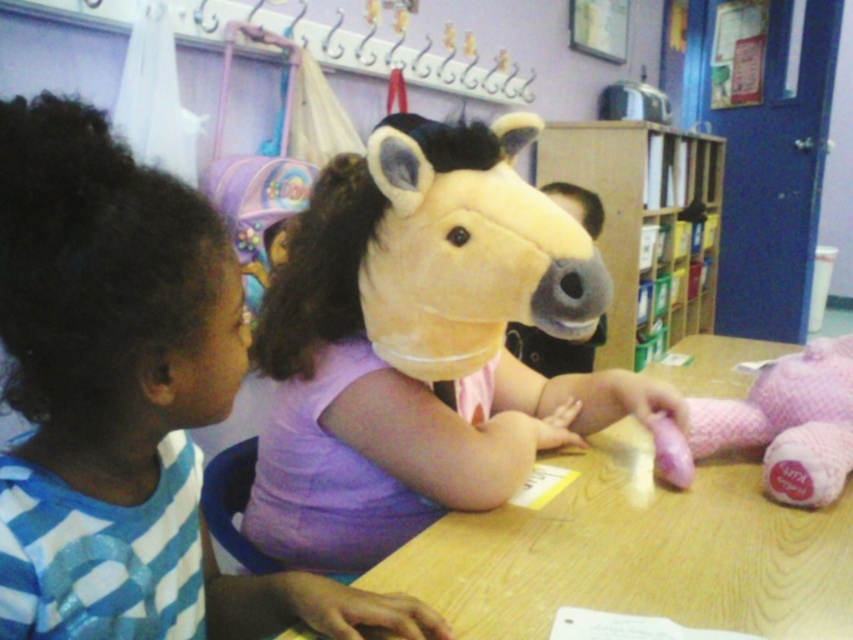
Question: Does wooden table at center appear on the right side of pink plush bear at right?

Choices:
 (A) no
 (B) yes

Answer: (A)

Question: Does soft plush horse head at center have a greater width compared to purple cotton shirt at upper center?

Choices:
 (A) no
 (B) yes

Answer: (B)

Question: Which object is closer to the camera taking this photo?

Choices:
 (A) soft plush horse head at center
 (B) wooden table at center
 (C) wooden bookshelf at center
 (D) pink plush bear at right

Answer: (B)

Question: Estimate the real-world distances between objects in this image. Which object is closer to the wooden bookshelf at center?

Choices:
 (A) soft plush horse head at center
 (B) pink plush bear at right
 (C) wooden table at center

Answer: (B)

Question: Which object is positioned closest to the pink plush bear at right?

Choices:
 (A) wooden bookshelf at center
 (B) wooden table at center
 (C) purple cotton shirt at upper center
 (D) soft plush horse head at center

Answer: (B)

Question: Can you confirm if soft plush horse head at center is bigger than pink plush bear at right?

Choices:
 (A) yes
 (B) no

Answer: (A)